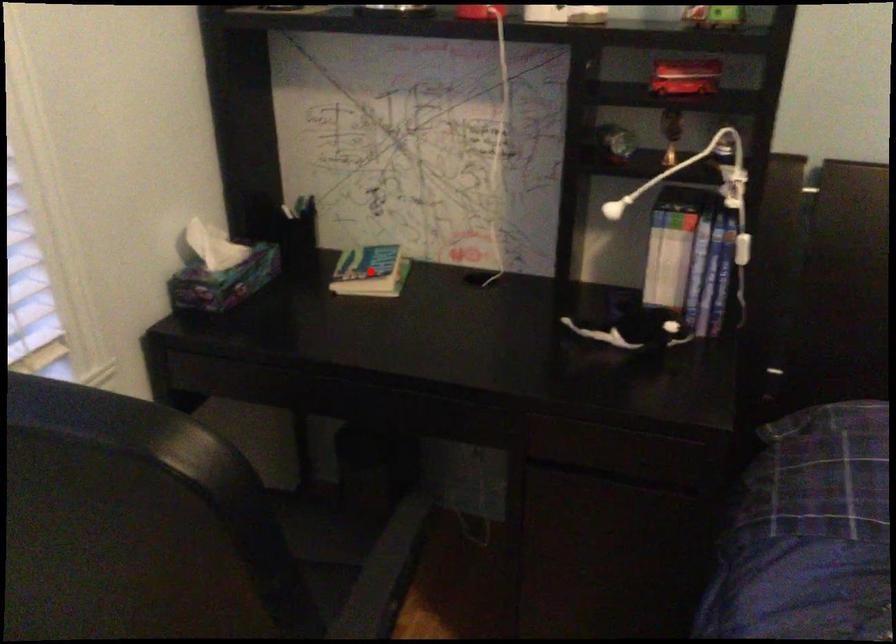
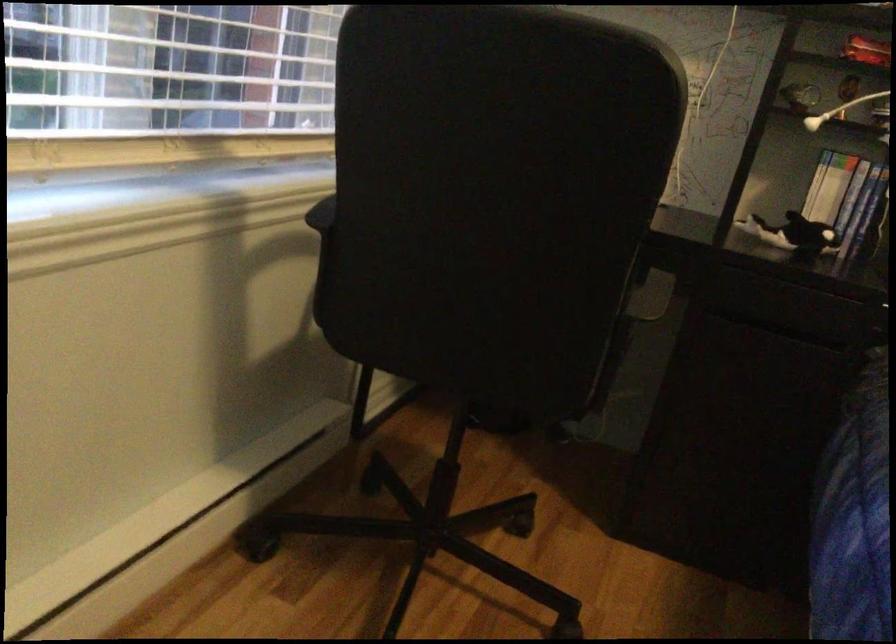
Question: I am providing you with two images of the same scene from different viewpoints. A red point is marked on the first image. Can you still see the location of the red point in image 2?

Choices:
 (A) Yes
 (B) No

Answer: (B)